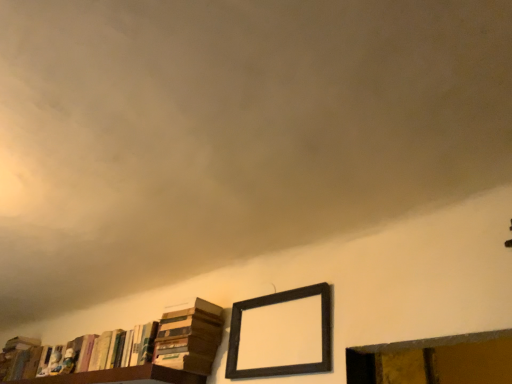
Question: From the image's perspective, is dark wood picture frame at upper center over hardcover book at lower left, which ranks as the 1th book in left-to-right order?

Choices:
 (A) yes
 (B) no

Answer: (A)

Question: From a real-world perspective, is dark wood picture frame at upper center positioned under hardcover book at lower left, which ranks as the 1th book in left-to-right order, based on gravity?

Choices:
 (A) no
 (B) yes

Answer: (B)

Question: Is dark wood picture frame at upper center positioned far away from hardcover book at lower left, which appears as the third book when viewed from the right?

Choices:
 (A) no
 (B) yes

Answer: (B)

Question: Is dark wood picture frame at upper center to the left of hardcover book at lower left, which ranks as the 1th book in left-to-right order, from the viewer's perspective?

Choices:
 (A) no
 (B) yes

Answer: (A)

Question: From the image's perspective, would you say dark wood picture frame at upper center is shown under hardcover book at lower left, which ranks as the 1th book in left-to-right order?

Choices:
 (A) no
 (B) yes

Answer: (A)

Question: Based on their positions, is wooden window frame at lower right located to the left or right of dark wood picture frame at upper center?

Choices:
 (A) left
 (B) right

Answer: (B)

Question: Is wooden window frame at lower right spatially inside dark wood picture frame at upper center, or outside of it?

Choices:
 (A) inside
 (B) outside

Answer: (B)

Question: Looking at their shapes, would you say wooden window frame at lower right is wider or thinner than dark wood picture frame at upper center?

Choices:
 (A) thin
 (B) wide

Answer: (B)

Question: From a real-world perspective, is wooden window frame at lower right physically located above or below dark wood picture frame at upper center?

Choices:
 (A) below
 (B) above

Answer: (A)

Question: From their relative heights in the image, would you say hardcover book at lower left, which ranks as the 1th book in left-to-right order, is taller or shorter than hardcover books at lower left, marked as the 1th book in a right-to-left arrangement?

Choices:
 (A) short
 (B) tall

Answer: (B)

Question: Looking at the image, does hardcover book at lower left, which ranks as the 1th book in left-to-right order, seem bigger or smaller compared to hardcover books at lower left, marked as the 1th book in a right-to-left arrangement?

Choices:
 (A) small
 (B) big

Answer: (A)

Question: Is hardcover book at lower left, which ranks as the 1th book in left-to-right order, in front of or behind hardcover books at lower left, the 3th book positioned from the left, in the image?

Choices:
 (A) front
 (B) behind

Answer: (B)

Question: From the image's perspective, relative to hardcover books at lower left, the 3th book positioned from the left, is hardcover book at lower left, which appears as the third book when viewed from the right, above or below?

Choices:
 (A) above
 (B) below

Answer: (B)

Question: From the image's perspective, is hardcover books at lower left, which is the second book from left to right, located above or below dark wood picture frame at upper center?

Choices:
 (A) below
 (B) above

Answer: (A)

Question: Looking at their shapes, would you say hardcover books at lower left, which is the second book from left to right, is wider or thinner than dark wood picture frame at upper center?

Choices:
 (A) thin
 (B) wide

Answer: (B)